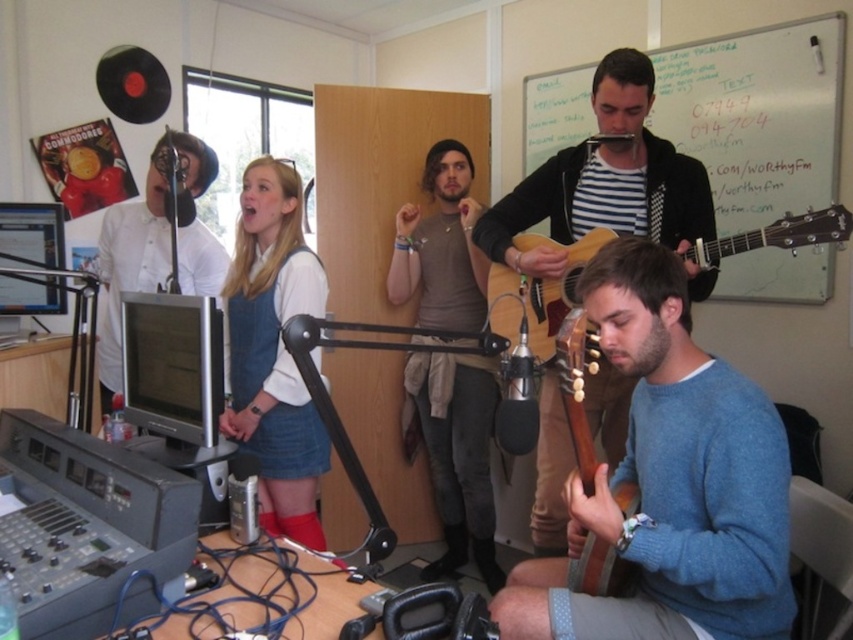
You are a stagehand setting up equipment for a live performance. You need to ensure that the white glossy microphone at left and the brown wooden guitar at lower right are positioned so that the microphone is visible to the audience. Given their current heights, will the microphone be visible over the guitar?

The white glossy microphone at left is taller than the brown wooden guitar at lower right, so yes, the microphone will be visible over the guitar to the audience.